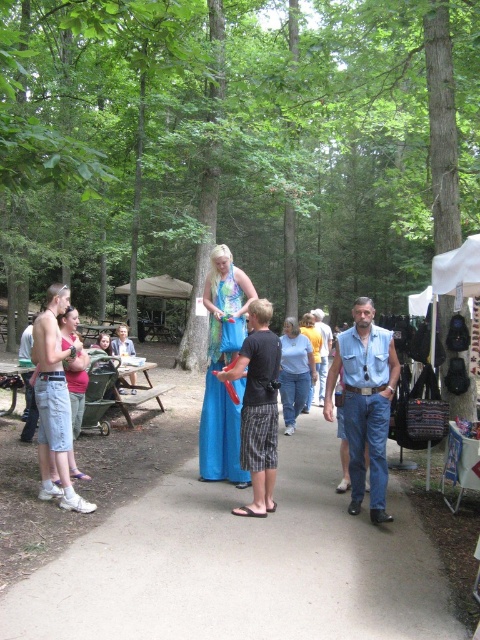
Question: Is smooth concrete path at center positioned behind brown wooden picnic table at left?

Choices:
 (A) yes
 (B) no

Answer: (B)

Question: Which object is the farthest from the shiny blue fabric dress at center?

Choices:
 (A) brown wooden picnic table at left
 (B) denim vest at center

Answer: (A)

Question: Does denim vest at center appear over shiny blue fabric dress at center?

Choices:
 (A) no
 (B) yes

Answer: (A)

Question: Among these objects, which one is nearest to the camera?

Choices:
 (A) denim vest at center
 (B) smooth concrete path at center

Answer: (B)

Question: Which of the following is the closest to the observer?

Choices:
 (A) (338, 525)
 (B) (349, 394)
 (C) (142, 394)

Answer: (A)

Question: Is denim vest at center above brown wooden picnic table at left?

Choices:
 (A) no
 (B) yes

Answer: (B)